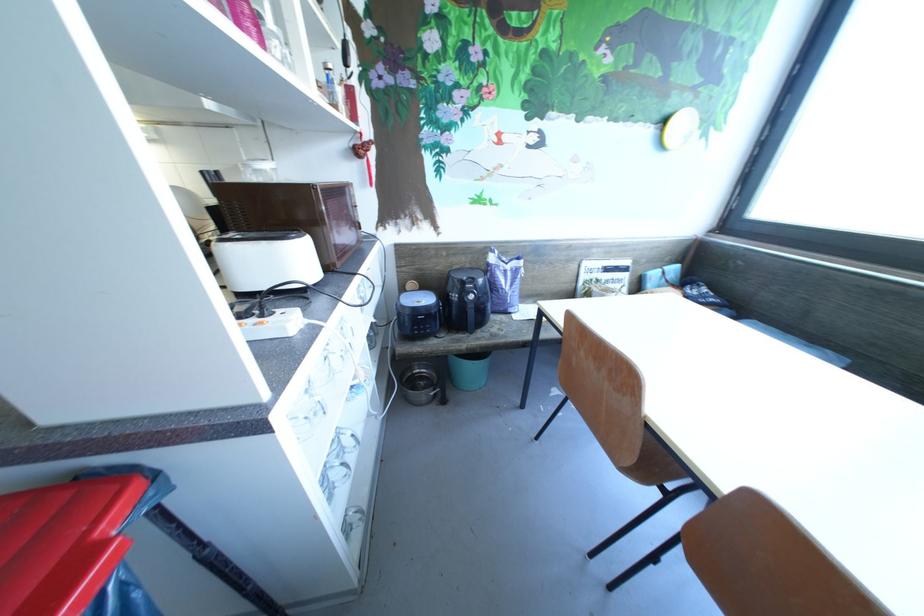
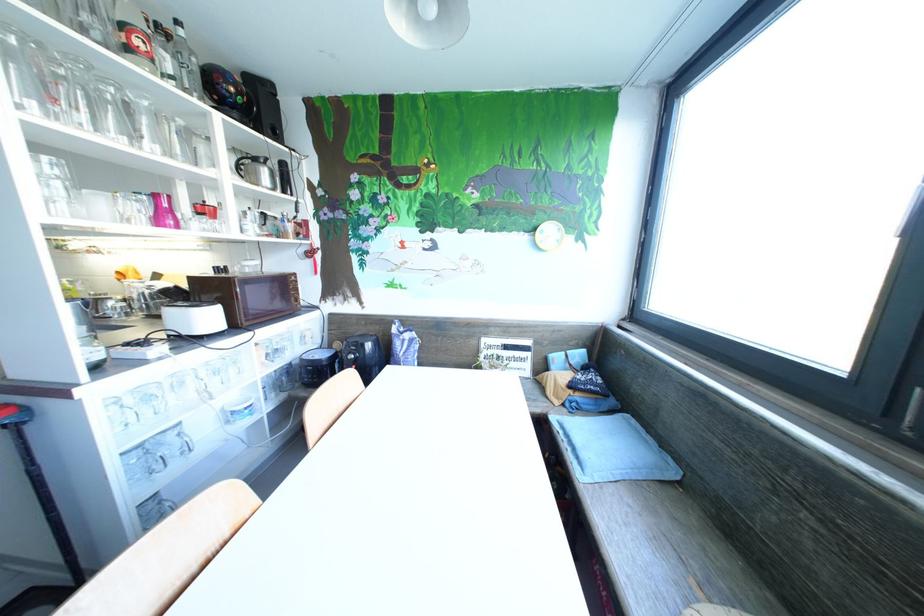
Question: I am providing you with two images of the same scene from different viewpoints. Which of the following objects are not visible in image2?

Choices:
 (A) glass cup
 (B) metal bowl
 (C) chair sitting surface
 (D) DVD player disc slot

Answer: (B)